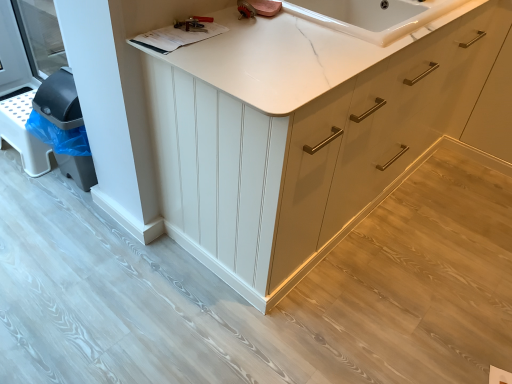
At what (x,y) coordinates should I click in order to perform the action: click on free space in front of matte white cabinet at center. Please return your answer as a coordinate pair (x, y). Looking at the image, I should click on (351, 289).